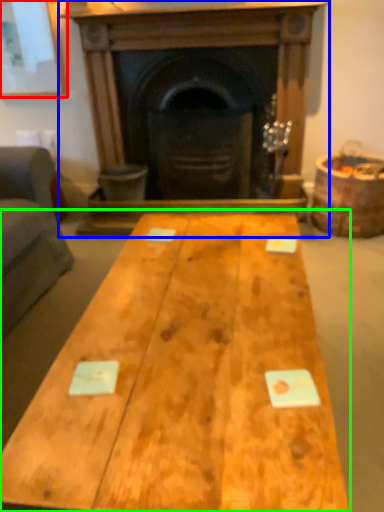
Question: Which is farther away from picture frame (highlighted by a red box)? fireplace (highlighted by a blue box) or table (highlighted by a green box)?

Choices:
 (A) fireplace
 (B) table

Answer: (B)